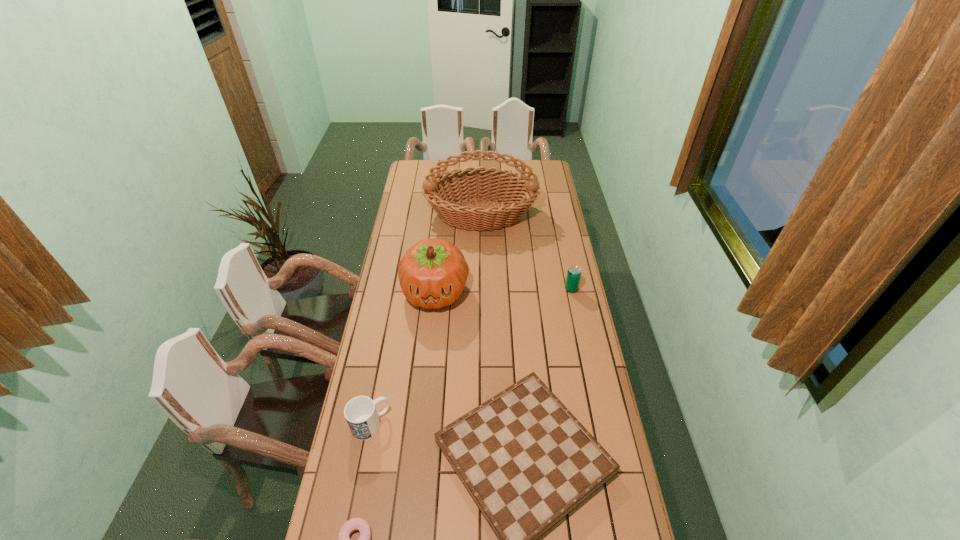
At what (x,y) coordinates should I click in order to perform the action: click on object that is the closest one to the second shortest object. Please return your answer as a coordinate pair (x, y). Looking at the image, I should click on (353, 524).